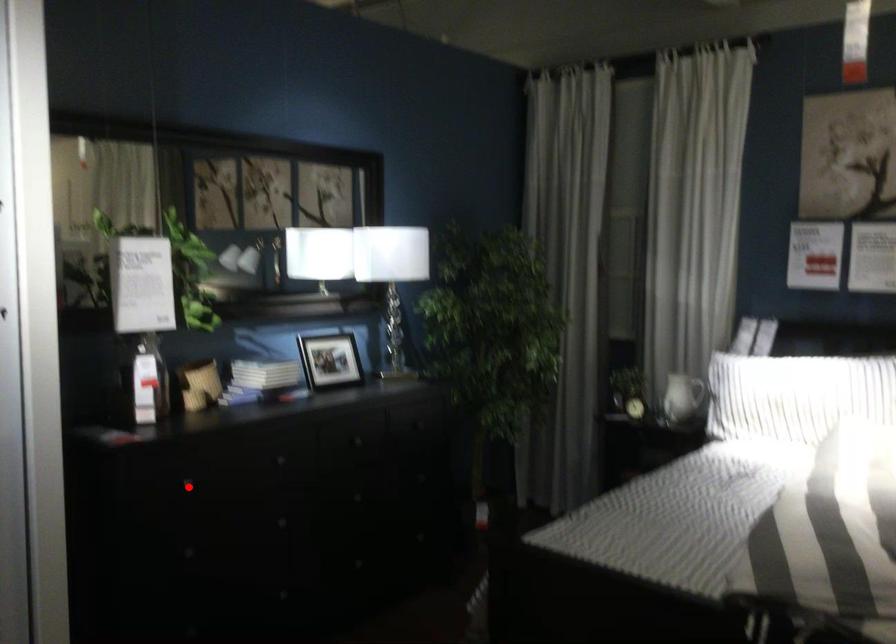
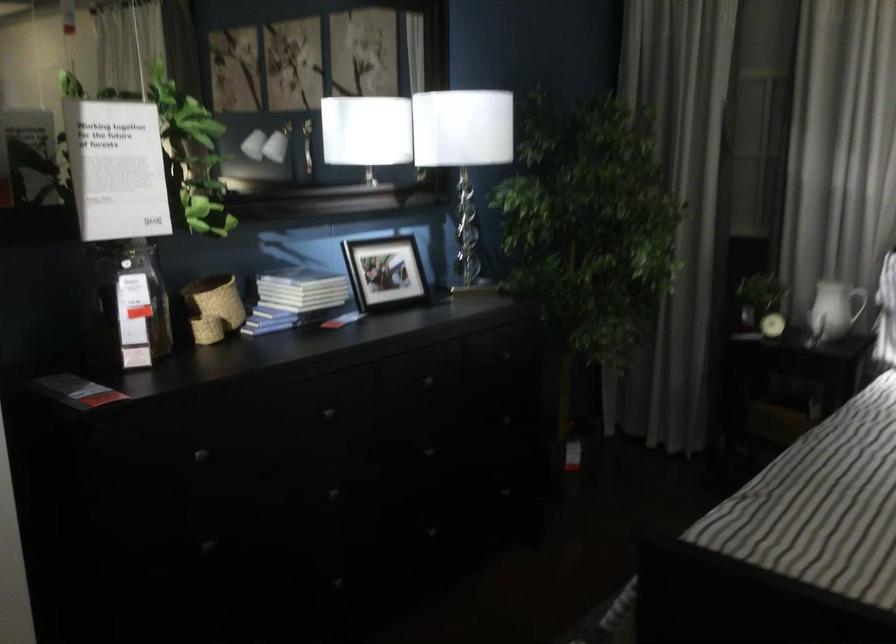
Locate, in the second image, the point that corresponds to the highlighted location in the first image.

(200, 456)